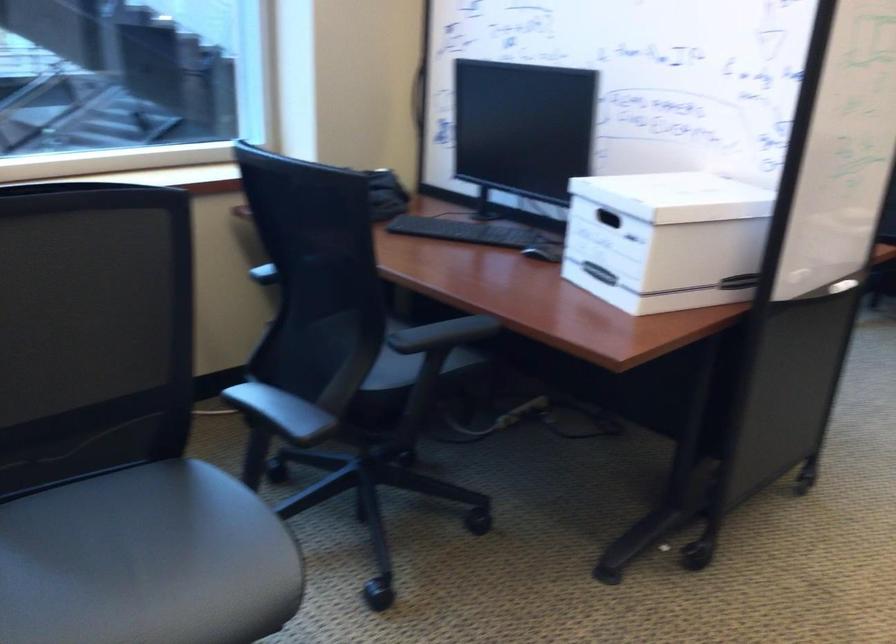
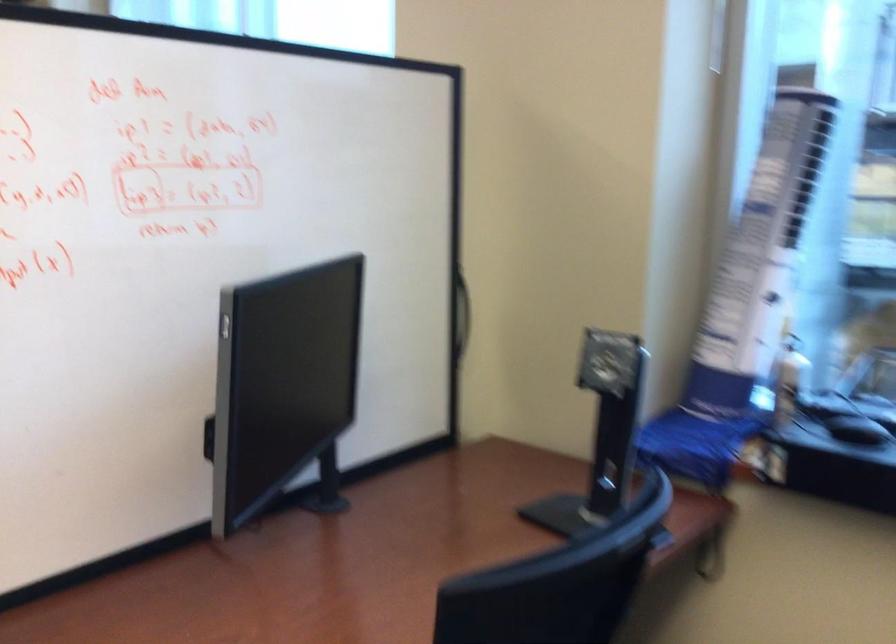
In the second image, find the point that corresponds to point 544,201 in the first image.

(325, 487)